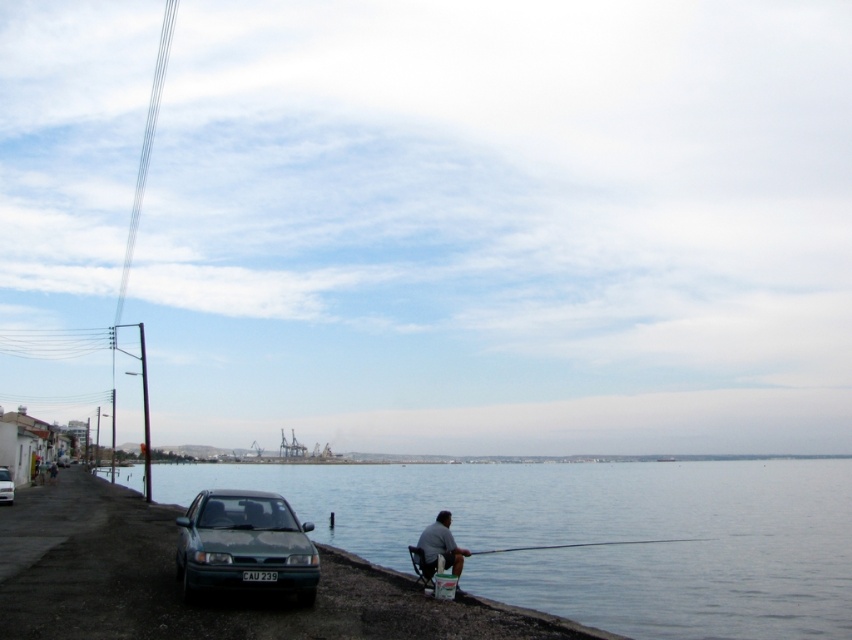
Which of these two, green matte sedan at lower left or smooth wooden rod at lower center, stands taller?

green matte sedan at lower left is taller.

Which is more to the left, green matte sedan at lower left or smooth wooden rod at lower center?

From the viewer's perspective, green matte sedan at lower left appears more on the left side.

Is point (243, 563) positioned after point (676, 540)?

No, (243, 563) is in front of (676, 540).

At what (x,y) coordinates should I click in order to perform the action: click on green matte sedan at lower left. Please return your answer as a coordinate pair (x, y). Looking at the image, I should click on (245, 545).

Does clear water at lower left come behind green matte sedan at lower left?

Yes, clear water at lower left is further from the viewer.

Does point (797, 621) come closer to viewer compared to point (191, 557)?

That is False.

Locate an element on the screen. This screenshot has width=852, height=640. clear water at lower left is located at coordinates (597, 534).

Identify the location of clear water at lower left. This screenshot has height=640, width=852. (597, 534).

Measure the distance between clear water at lower left and camera.

A distance of 13.64 meters exists between clear water at lower left and camera.

In the scene shown: Who is taller, clear water at lower left or smooth wooden rod at lower center?

With more height is clear water at lower left.

Which is behind, point (435, 502) or point (504, 548)?

The point (435, 502) is behind.

This screenshot has width=852, height=640. Identify the location of clear water at lower left. (597, 534).